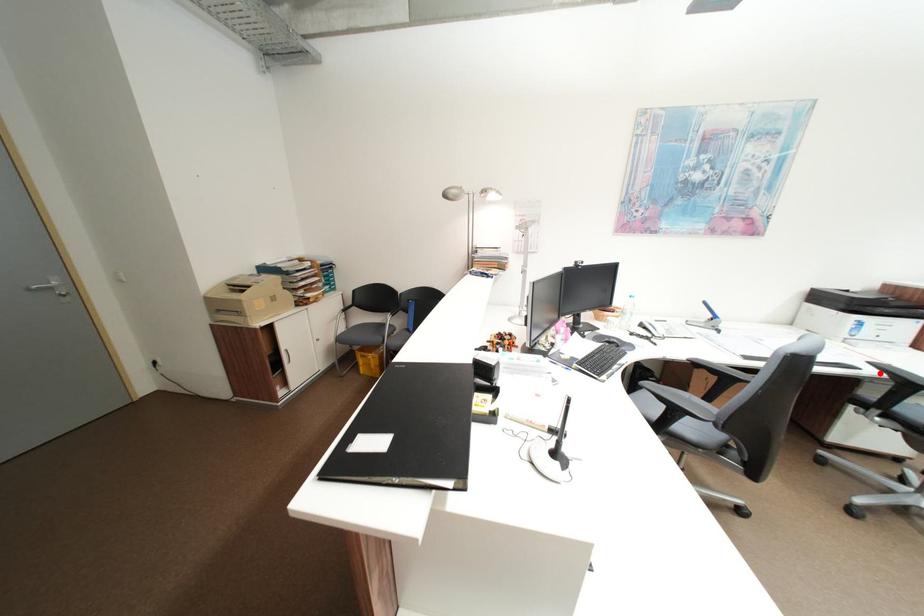
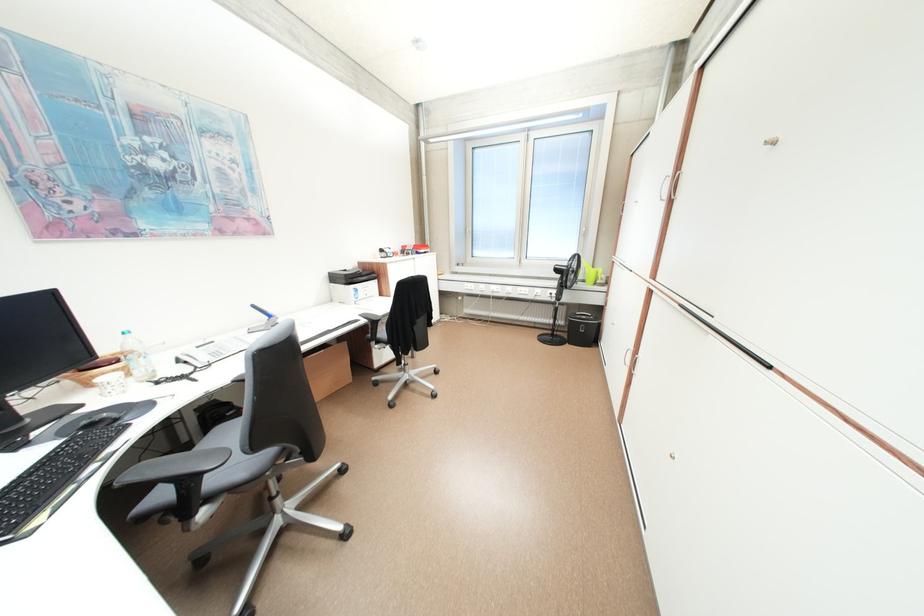
Question: I am providing you with two images of the same scene from different viewpoints. In image1, a red point is highlighted. Considering the same 3D point in image2, which of the following is correct?

Choices:
 (A) It is closer
 (B) It is farther

Answer: (A)